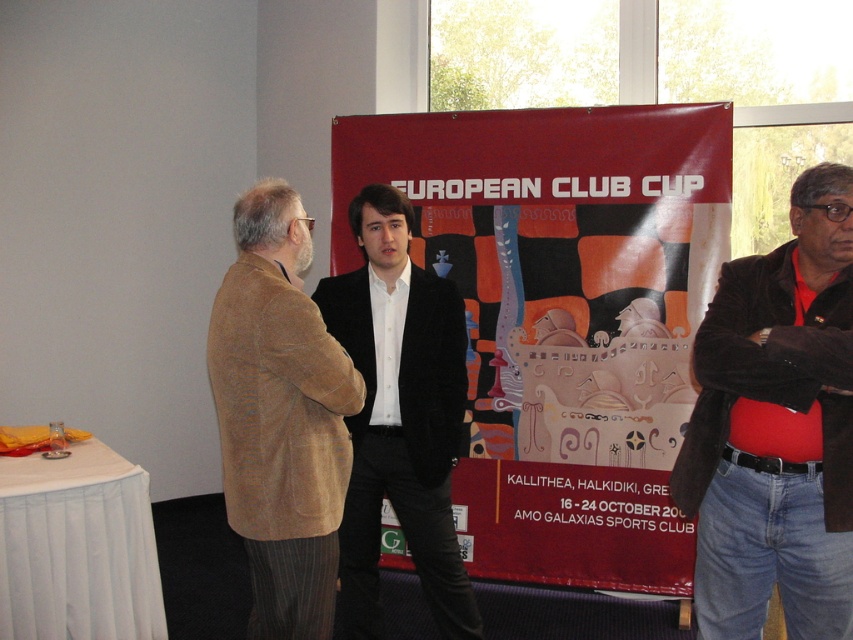
Question: Is brown corduroy blazer at center smaller than black velvet blazer at center?

Choices:
 (A) no
 (B) yes

Answer: (A)

Question: Which object is the farthest from the black velvet blazer at center?

Choices:
 (A) red fabric banner at center
 (B) velvet brown jacket at right

Answer: (A)

Question: Which object is closer to the camera taking this photo?

Choices:
 (A) brown corduroy blazer at center
 (B) black velvet blazer at center
 (C) red fabric banner at center

Answer: (A)

Question: Which is farther from the red fabric banner at center?

Choices:
 (A) brown corduroy blazer at center
 (B) black velvet blazer at center
 (C) velvet brown jacket at right

Answer: (A)

Question: Can you confirm if red fabric banner at center is positioned above black velvet blazer at center?

Choices:
 (A) yes
 (B) no

Answer: (A)

Question: Does velvet brown jacket at right appear on the right side of brown corduroy blazer at center?

Choices:
 (A) no
 (B) yes

Answer: (B)